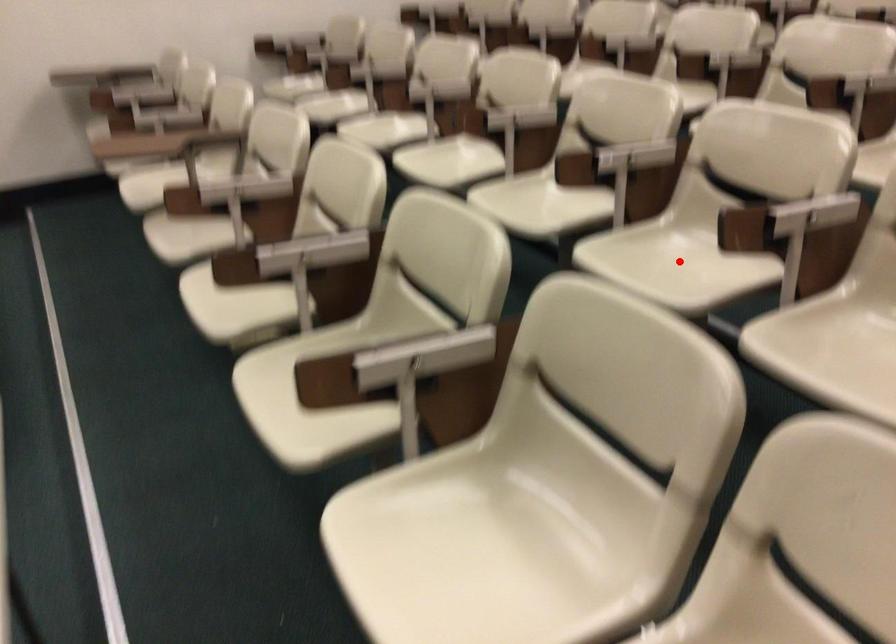
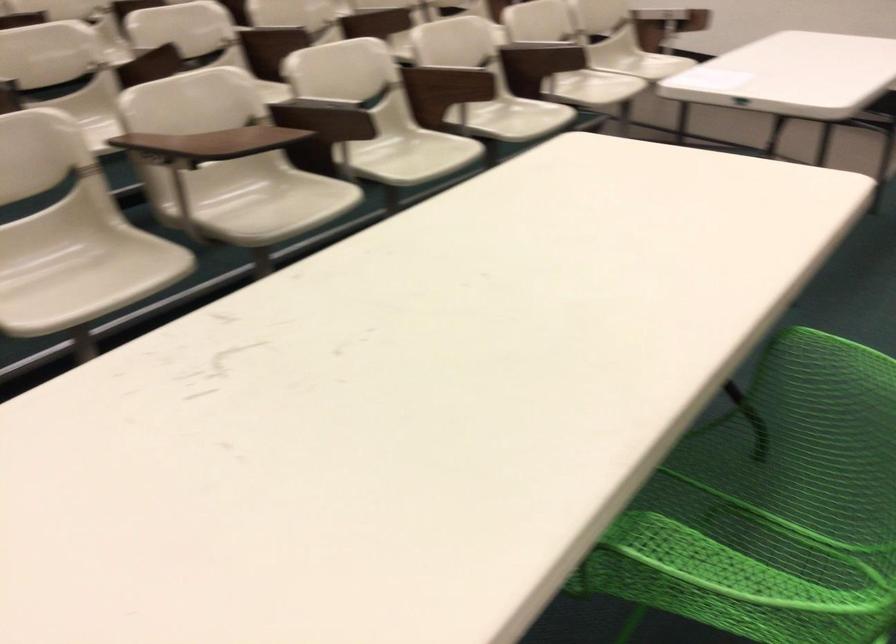
Question: I am providing you with two images of the same scene from different viewpoints. A red point is marked on the first image. Can you still see the location of the red point in image 2?

Choices:
 (A) Yes
 (B) No

Answer: (B)